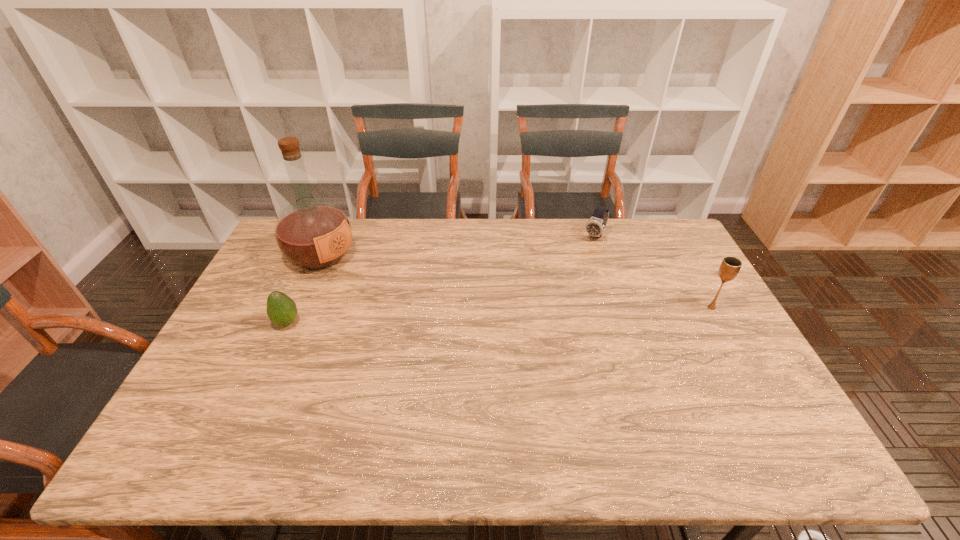
You are a GUI agent. You are given a task and a screenshot of the screen. Output one action in this format:
    pyautogui.click(x=<x>, y=<y>)
    Task: Click on the free space located on the face of the watch
    Image resolution: width=960 pixels, height=540 pixels.
    Given the screenshot: What is the action you would take?
    pyautogui.click(x=580, y=259)

Find the location of `free space located on the face of the watch`. free space located on the face of the watch is located at coordinates (576, 266).

Identify the location of vacant space located 0.200m on the face of the watch. This screenshot has height=540, width=960. (568, 276).

Locate an element on the screen. The width and height of the screenshot is (960, 540). liquor located at the far edge is located at coordinates (313, 233).

Find the location of a particular element. The height and width of the screenshot is (540, 960). watch that is positioned at the far edge is located at coordinates (595, 227).

Locate an element on the screen. This screenshot has width=960, height=540. avocado positioned at the left edge is located at coordinates point(281,309).

Identify the location of liquor that is at the left edge. (313, 233).

What are the coordinates of `object that is at the right edge` in the screenshot? It's located at (730, 266).

Locate an element on the screen. This screenshot has width=960, height=540. object situated at the far left corner is located at coordinates (313, 233).

In the image, there is a desktop. Where is `free space at the far edge`? free space at the far edge is located at coordinates (405, 252).